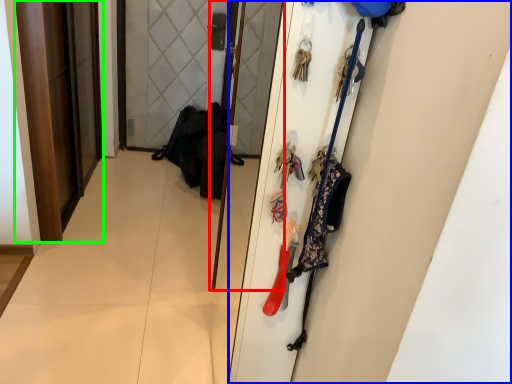
Question: Which object is the closest to the screen door (highlighted by a red box)? Choose among these: door (highlighted by a blue box) or door (highlighted by a green box).

Choices:
 (A) door
 (B) door

Answer: (B)